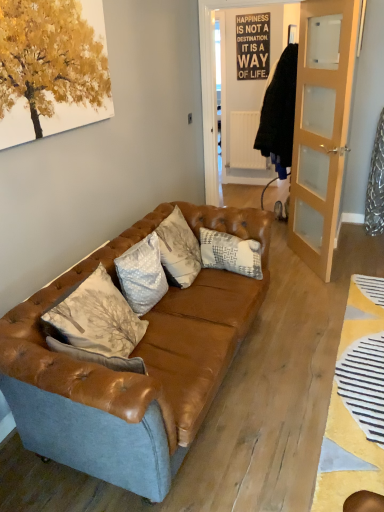
What are the coordinates of `empty space that is to the right of leather couch at center` in the screenshot? It's located at (296, 351).